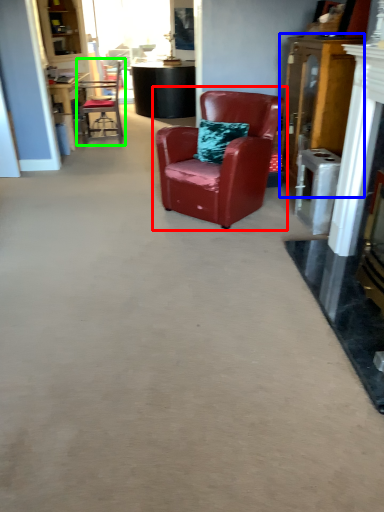
Question: Which is farther away from chair (highlighted by a red box)? dresser (highlighted by a blue box) or chair (highlighted by a green box)?

Choices:
 (A) dresser
 (B) chair

Answer: (B)